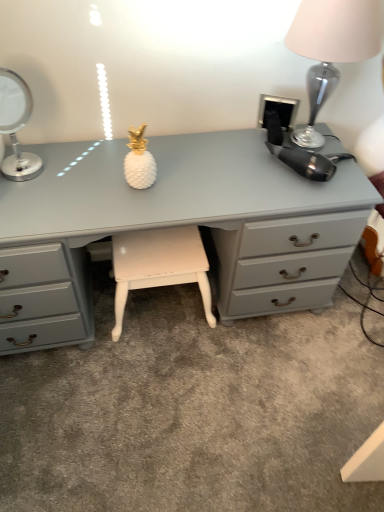
At what (x,y) coordinates should I click in order to perform the action: click on matte gray desk at center. Please return your answer as a coordinate pair (x, y). Looking at the image, I should click on (174, 226).

Where is `metallic silver table lamp at upper right, the 2th table lamp from the left`? The width and height of the screenshot is (384, 512). metallic silver table lamp at upper right, the 2th table lamp from the left is located at coordinates (331, 49).

This screenshot has width=384, height=512. What do you see at coordinates (331, 49) in the screenshot?
I see `metallic silver table lamp at upper right, which appears as the first table lamp when viewed from the right` at bounding box center [331, 49].

What are the coordinates of `white painted wood stool at center` in the screenshot? It's located at (159, 265).

The image size is (384, 512). I want to click on the 1st table lamp above when counting from the matte gray desk at center (from the image's perspective), so click(x=16, y=126).

Which is less distant, (32, 159) or (85, 268)?

Point (32, 159).

From the image's perspective, is silver metallic table lamp at left, marked as the second table lamp in a right-to-left arrangement, positioned above or below matte gray desk at center?

silver metallic table lamp at left, marked as the second table lamp in a right-to-left arrangement, is situated higher than matte gray desk at center in the image.

Which is correct: silver metallic table lamp at left, which appears as the 1th table lamp when viewed from the left, is inside matte gray desk at center, or outside of it?

silver metallic table lamp at left, which appears as the 1th table lamp when viewed from the left, is spatially situated outside matte gray desk at center.

Does metallic silver table lamp at upper right, the 2th table lamp from the left, have a greater height compared to matte gray desk at center?

No, metallic silver table lamp at upper right, the 2th table lamp from the left, is not taller than matte gray desk at center.

Is matte gray desk at center at the back of metallic silver table lamp at upper right, which appears as the first table lamp when viewed from the right?

No, metallic silver table lamp at upper right, which appears as the first table lamp when viewed from the right, is not facing away from matte gray desk at center.

Where is `desk located on the left of metallic silver table lamp at upper right, which appears as the first table lamp when viewed from the right`? The height and width of the screenshot is (512, 384). desk located on the left of metallic silver table lamp at upper right, which appears as the first table lamp when viewed from the right is located at coordinates pos(174,226).

From the image's perspective, between metallic silver table lamp at upper right, which appears as the first table lamp when viewed from the right, and matte gray desk at center, who is located below?

From the image's view, matte gray desk at center is below.

Is white painted wood stool at center positioned in front of silver metallic table lamp at left, which appears as the 1th table lamp when viewed from the left?

No, the depth of white painted wood stool at center is greater than that of silver metallic table lamp at left, which appears as the 1th table lamp when viewed from the left.

Looking at this image, from the image's perspective, is white painted wood stool at center under silver metallic table lamp at left, marked as the second table lamp in a right-to-left arrangement?

Yes.

Is white painted wood stool at center next to silver metallic table lamp at left, which appears as the 1th table lamp when viewed from the left, and touching it?

white painted wood stool at center and silver metallic table lamp at left, which appears as the 1th table lamp when viewed from the left, are not in contact.

Is white painted wood stool at center inside the boundaries of silver metallic table lamp at left, which appears as the 1th table lamp when viewed from the left, or outside?

white painted wood stool at center cannot be found inside silver metallic table lamp at left, which appears as the 1th table lamp when viewed from the left.

There is a silver metallic table lamp at left, which appears as the 1th table lamp when viewed from the left. Where is `table lamp above it (from a real-world perspective)`? table lamp above it (from a real-world perspective) is located at coordinates (331, 49).

Looking at the image, does metallic silver table lamp at upper right, the 2th table lamp from the left, seem bigger or smaller compared to silver metallic table lamp at left, marked as the second table lamp in a right-to-left arrangement?

metallic silver table lamp at upper right, the 2th table lamp from the left, is bigger than silver metallic table lamp at left, marked as the second table lamp in a right-to-left arrangement.

Is metallic silver table lamp at upper right, the 2th table lamp from the left, outside of silver metallic table lamp at left, marked as the second table lamp in a right-to-left arrangement?

metallic silver table lamp at upper right, the 2th table lamp from the left, lies outside silver metallic table lamp at left, marked as the second table lamp in a right-to-left arrangement,'s area.

Could you measure the distance between metallic silver table lamp at upper right, which appears as the first table lamp when viewed from the right, and silver metallic table lamp at left, marked as the second table lamp in a right-to-left arrangement?

They are 37.85 inches apart.

Considering the sizes of objects matte gray desk at center and metallic silver table lamp at upper right, the 2th table lamp from the left, in the image provided, who is wider, matte gray desk at center or metallic silver table lamp at upper right, the 2th table lamp from the left,?

With larger width is matte gray desk at center.

Identify the location of table lamp on the right of the matte gray desk at center. (331, 49).

Would you say metallic silver table lamp at upper right, the 2th table lamp from the left, is part of matte gray desk at center's contents?

No, metallic silver table lamp at upper right, the 2th table lamp from the left, is not inside matte gray desk at center.

Is matte gray desk at center turned away from metallic silver table lamp at upper right, the 2th table lamp from the left?

No, matte gray desk at center's orientation is not away from metallic silver table lamp at upper right, the 2th table lamp from the left.

Considering the sizes of objects matte gray desk at center and white painted wood stool at center in the image provided, who is taller, matte gray desk at center or white painted wood stool at center?

matte gray desk at center is taller.

What's the angular difference between matte gray desk at center and white painted wood stool at center's facing directions?

The angular difference between matte gray desk at center and white painted wood stool at center is 0.00073 degrees.

Considering the relative positions of matte gray desk at center and white painted wood stool at center in the image provided, is matte gray desk at center to the left or to the right of white painted wood stool at center?

Based on their positions, matte gray desk at center is located to the right of white painted wood stool at center.

Between point (234, 280) and point (185, 276), which one is positioned in front?

Point (234, 280)

Which object is further away from the camera taking this photo, white painted wood stool at center or matte gray desk at center?

Positioned behind is white painted wood stool at center.

Based on their positions, is white painted wood stool at center located to the left or right of matte gray desk at center?

white painted wood stool at center is positioned on matte gray desk at center's left side.

In terms of height, does white painted wood stool at center look taller or shorter compared to matte gray desk at center?

white painted wood stool at center is shorter than matte gray desk at center.

Where is `desk on the right of silver metallic table lamp at left, which appears as the 1th table lamp when viewed from the left`? Image resolution: width=384 pixels, height=512 pixels. desk on the right of silver metallic table lamp at left, which appears as the 1th table lamp when viewed from the left is located at coordinates (174, 226).

Where is `desk lying below the metallic silver table lamp at upper right, which appears as the first table lamp when viewed from the right (from the image's perspective)`? desk lying below the metallic silver table lamp at upper right, which appears as the first table lamp when viewed from the right (from the image's perspective) is located at coordinates (174, 226).

Based on their spatial positions, is white painted wood stool at center or matte gray desk at center closer to silver metallic table lamp at left, which appears as the 1th table lamp when viewed from the left?

matte gray desk at center is positioned closer to the anchor silver metallic table lamp at left, which appears as the 1th table lamp when viewed from the left.

Estimate the real-world distances between objects in this image. Which object is closer to silver metallic table lamp at left, which appears as the 1th table lamp when viewed from the left, white painted wood stool at center or metallic silver table lamp at upper right, which appears as the first table lamp when viewed from the right?

white painted wood stool at center is closer to silver metallic table lamp at left, which appears as the 1th table lamp when viewed from the left.

Considering their positions, is metallic silver table lamp at upper right, the 2th table lamp from the left, positioned further to white painted wood stool at center than matte gray desk at center?

metallic silver table lamp at upper right, the 2th table lamp from the left, is positioned further to the anchor white painted wood stool at center.

Looking at the image, which one is located closer to matte gray desk at center, metallic silver table lamp at upper right, the 2th table lamp from the left, or white painted wood stool at center?

white painted wood stool at center is positioned closer to the anchor matte gray desk at center.

Which object lies further to the anchor point matte gray desk at center, white painted wood stool at center or silver metallic table lamp at left, marked as the second table lamp in a right-to-left arrangement?

Based on the image, silver metallic table lamp at left, marked as the second table lamp in a right-to-left arrangement, appears to be further to matte gray desk at center.

Based on their spatial positions, is matte gray desk at center or metallic silver table lamp at upper right, which appears as the first table lamp when viewed from the right, further from silver metallic table lamp at left, marked as the second table lamp in a right-to-left arrangement?

Among the two, metallic silver table lamp at upper right, which appears as the first table lamp when viewed from the right, is located further to silver metallic table lamp at left, marked as the second table lamp in a right-to-left arrangement.

Looking at the image, which one is located closer to silver metallic table lamp at left, which appears as the 1th table lamp when viewed from the left, matte gray desk at center or white painted wood stool at center?

matte gray desk at center is positioned closer to the anchor silver metallic table lamp at left, which appears as the 1th table lamp when viewed from the left.

Looking at the image, which one is located closer to white painted wood stool at center, matte gray desk at center or metallic silver table lamp at upper right, which appears as the first table lamp when viewed from the right?

Among the two, matte gray desk at center is located nearer to white painted wood stool at center.

Where is `desk between metallic silver table lamp at upper right, which appears as the first table lamp when viewed from the right, and white painted wood stool at center, in the vertical direction`? The image size is (384, 512). desk between metallic silver table lamp at upper right, which appears as the first table lamp when viewed from the right, and white painted wood stool at center, in the vertical direction is located at coordinates (174, 226).

What are the coordinates of `desk between silver metallic table lamp at left, marked as the second table lamp in a right-to-left arrangement, and white painted wood stool at center in the up-down direction` in the screenshot? It's located at (174, 226).

Where is `stool between silver metallic table lamp at left, marked as the second table lamp in a right-to-left arrangement, and metallic silver table lamp at upper right, which appears as the first table lamp when viewed from the right, in the horizontal direction`? Image resolution: width=384 pixels, height=512 pixels. stool between silver metallic table lamp at left, marked as the second table lamp in a right-to-left arrangement, and metallic silver table lamp at upper right, which appears as the first table lamp when viewed from the right, in the horizontal direction is located at coordinates [x=159, y=265].

Where is `desk between silver metallic table lamp at left, which appears as the 1th table lamp when viewed from the left, and metallic silver table lamp at upper right, the 2th table lamp from the left`? desk between silver metallic table lamp at left, which appears as the 1th table lamp when viewed from the left, and metallic silver table lamp at upper right, the 2th table lamp from the left is located at coordinates (174, 226).